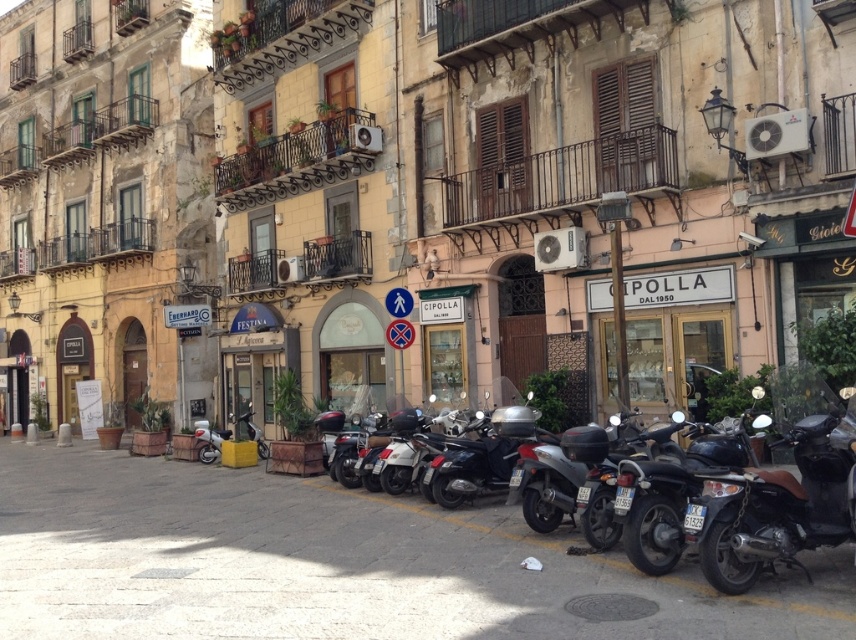
Locate an element on the screen. This screenshot has width=856, height=640. silver metallic scooter at center is located at coordinates (568, 484).

Does point (587, 532) come in front of point (259, 445)?

Yes, point (587, 532) is in front of point (259, 445).

The width and height of the screenshot is (856, 640). I want to click on silver metallic scooter at center, so click(568, 484).

Who is more distant from viewer, (848, 406) or (637, 513)?

The point (848, 406) is more distant.

Can you confirm if shiny black scooter at lower right is smaller than shiny black motorcycle at center right?

Yes.

Between point (804, 545) and point (631, 532), which one is positioned in front?

Positioned in front is point (804, 545).

You are a GUI agent. You are given a task and a screenshot of the screen. Output one action in this format:
    pyautogui.click(x=<x>, y=<y>)
    Task: Click on the shiny black scooter at lower right
    
    Given the screenshot: What is the action you would take?
    pyautogui.click(x=774, y=504)

Who is lower down, silver metallic scooter at center or shiny black scooter at center?

silver metallic scooter at center

Can you confirm if silver metallic scooter at center is wider than shiny black scooter at center?

No.

Who is more distant from viewer, (575,483) or (450,499)?

The point (450,499) is behind.

The height and width of the screenshot is (640, 856). What are the coordinates of `silver metallic scooter at center` in the screenshot? It's located at (568, 484).